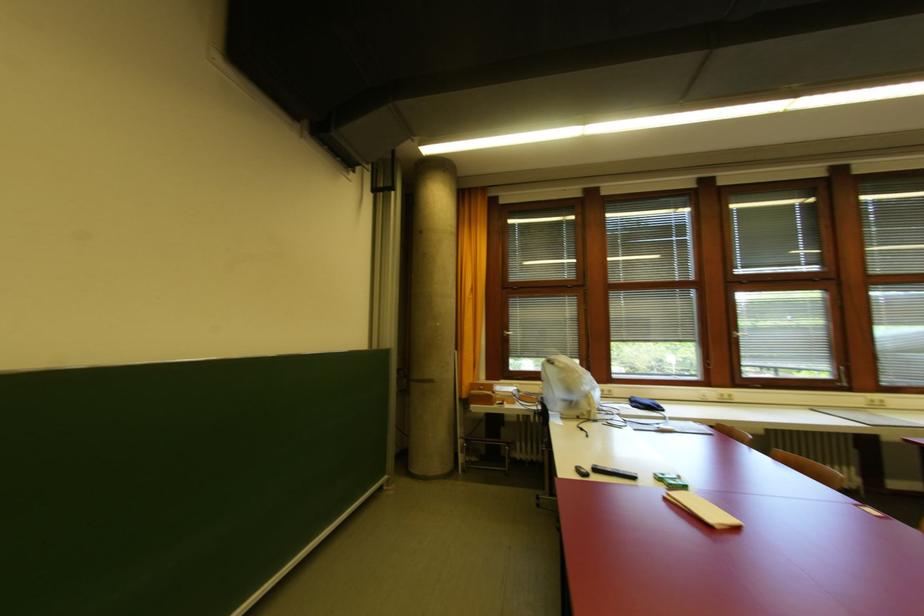
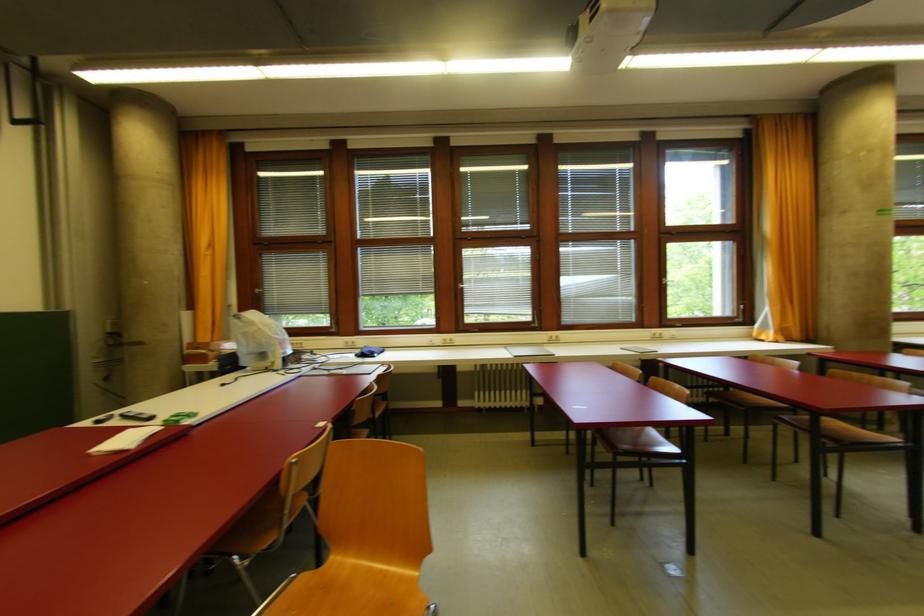
Question: Which direction would the cameraman need to move to produce the second image? Reply with the corresponding letter.

Choices:
 (A) Left
 (B) Right
 (C) Forward
 (D) Backward

Answer: (B)